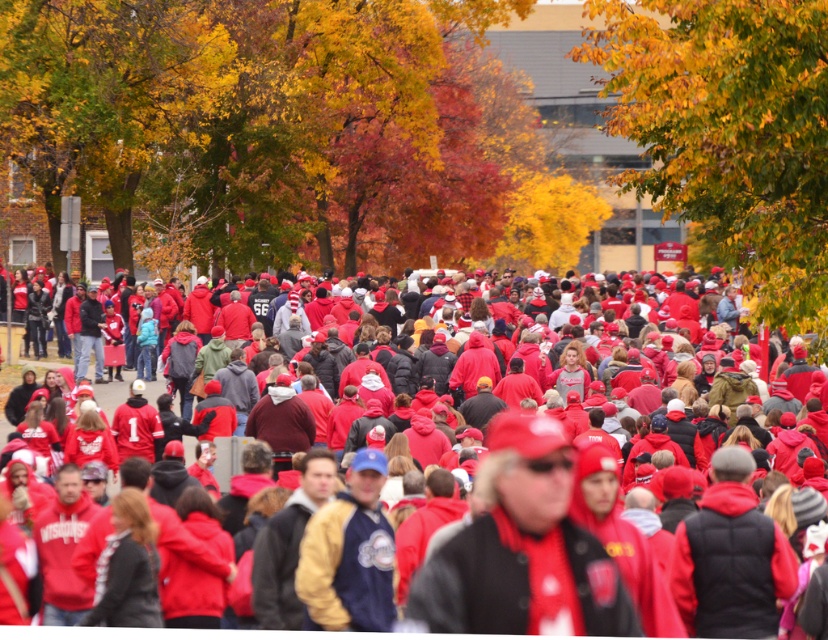
You are a photographer trying to capture a closeup of the matte red cap at center. Based on its position, where should you aim your camera? Please provide coordinates in the format of a point between 0 and 1 in both x and y axes.

The matte red cap at center is located at point coordinates of 0.864 in the x axis and 0.634 in the y axis.